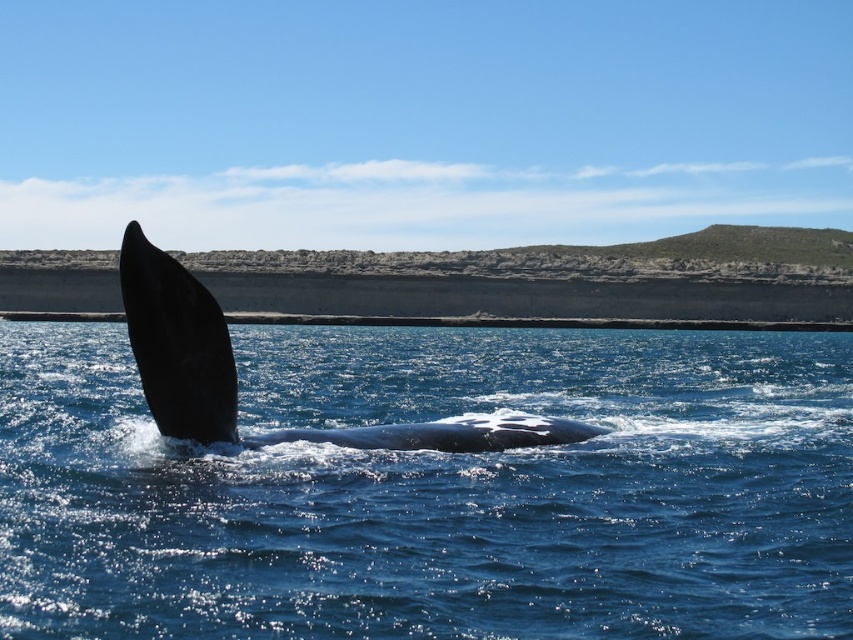
Question: Does blue water at center have a larger size compared to smooth dark gray whale at center?

Choices:
 (A) no
 (B) yes

Answer: (B)

Question: Which point is farther to the camera?

Choices:
 (A) blue water at center
 (B) black smooth whale at left
 (C) smooth dark gray whale at center

Answer: (B)

Question: Estimate the real-world distances between objects in this image. Which object is closer to the blue water at center?

Choices:
 (A) black smooth whale at left
 (B) smooth dark gray whale at center

Answer: (B)

Question: Is the position of smooth dark gray whale at center less distant than that of black smooth whale at left?

Choices:
 (A) yes
 (B) no

Answer: (A)

Question: Is smooth dark gray whale at center bigger than black smooth whale at left?

Choices:
 (A) yes
 (B) no

Answer: (A)

Question: Which of these objects is positioned closest to the smooth dark gray whale at center?

Choices:
 (A) blue water at center
 (B) black smooth whale at left

Answer: (B)